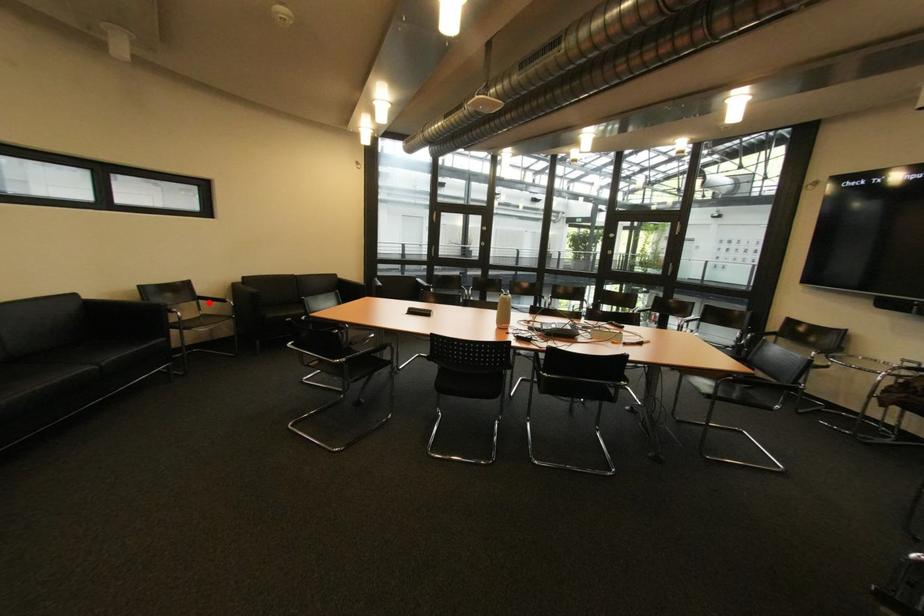
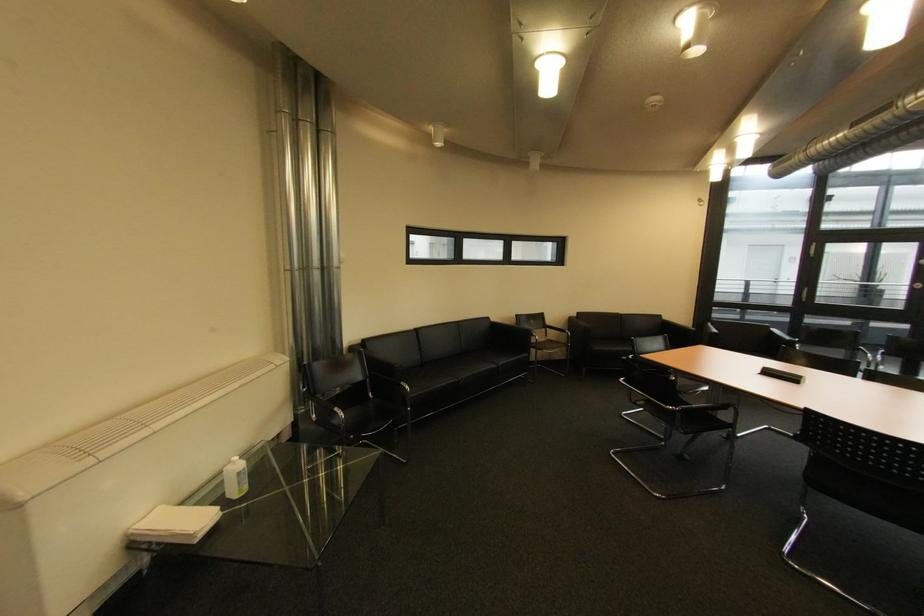
Where in the second image is the point corresponding to the highlighted location from the first image?

(555, 330)